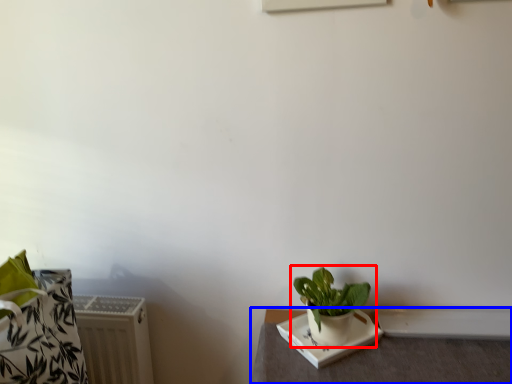
Question: Which of the following is the farthest to the observer, houseplant (highlighted by a red box) or table (highlighted by a blue box)?

Choices:
 (A) houseplant
 (B) table

Answer: (A)